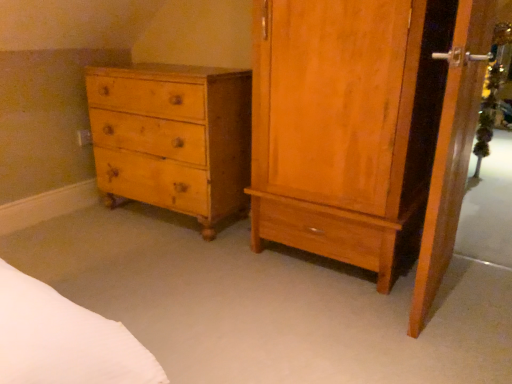
Where is `vacant area situated to the left side of yellow wood chest of drawers at left`? The image size is (512, 384). vacant area situated to the left side of yellow wood chest of drawers at left is located at coordinates (68, 231).